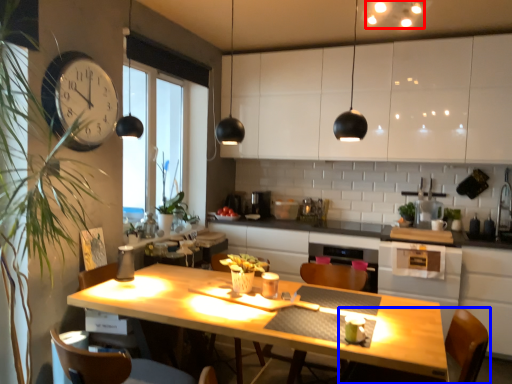
Question: Which object appears farthest to the camera in this image, lighting (highlighted by a red box) or chair (highlighted by a blue box)?

Choices:
 (A) lighting
 (B) chair

Answer: (A)